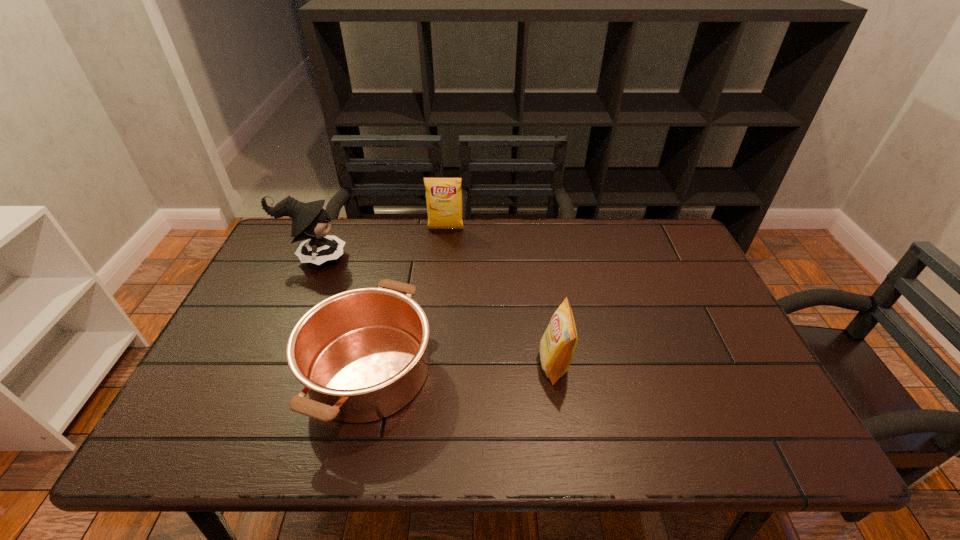
Image resolution: width=960 pixels, height=540 pixels. Find the location of `the third nearest object`. the third nearest object is located at coordinates (310, 221).

Image resolution: width=960 pixels, height=540 pixels. Identify the location of the left crisp (potato chip). (443, 195).

Find the location of a particular element. the farthest object is located at coordinates (443, 195).

Where is `the rightmost object`? This screenshot has width=960, height=540. the rightmost object is located at coordinates (557, 346).

Find the location of a particular element. This screenshot has width=960, height=540. the right crisp (potato chip) is located at coordinates (557, 346).

Image resolution: width=960 pixels, height=540 pixels. What are the coordinates of `the shortest object` in the screenshot? It's located at coord(361,354).

Identify the location of free space located at the face of the second farthest object. (376, 258).

At what (x,y) coordinates should I click in order to perform the action: click on free space located on the front of the farthest object with the logo. Please return your answer as a coordinate pair (x, y). Looking at the image, I should click on (444, 253).

I want to click on vacant position located on the front-facing side of the nearer crisp (potato chip), so click(461, 364).

This screenshot has height=540, width=960. I want to click on free space located 0.170m on the front-facing side of the nearer crisp (potato chip), so click(469, 364).